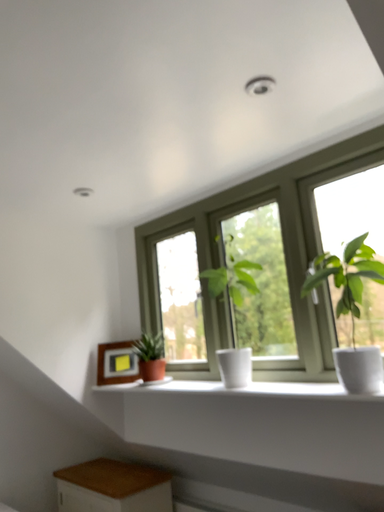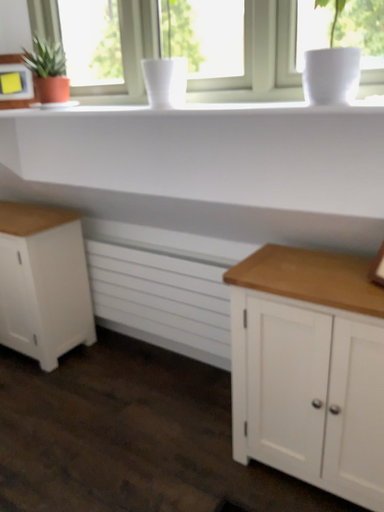
Question: How did the camera likely rotate when shooting the video?

Choices:
 (A) rotated downward
 (B) rotated upward

Answer: (A)